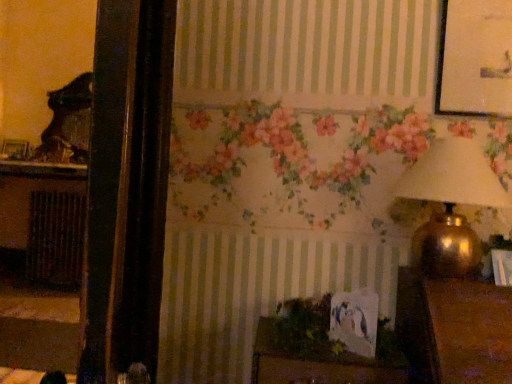
Question: Considering the positions of brown textured radiator at left and wooden picture frame at left in the image, is brown textured radiator at left wider or thinner than wooden picture frame at left?

Choices:
 (A) thin
 (B) wide

Answer: (B)

Question: Considering the positions of brown textured radiator at left and wooden picture frame at left in the image, is brown textured radiator at left bigger or smaller than wooden picture frame at left?

Choices:
 (A) small
 (B) big

Answer: (B)

Question: Based on their relative distances, which object is farther from the brown textured radiator at left?

Choices:
 (A) wooden picture frame at left
 (B) gold metallic lampshade at upper right
 (C) green leafy plant at center

Answer: (B)

Question: Based on their relative distances, which object is nearer to the brown textured radiator at left?

Choices:
 (A) wooden picture frame at left
 (B) gold metallic lampshade at upper right
 (C) green leafy plant at center

Answer: (A)